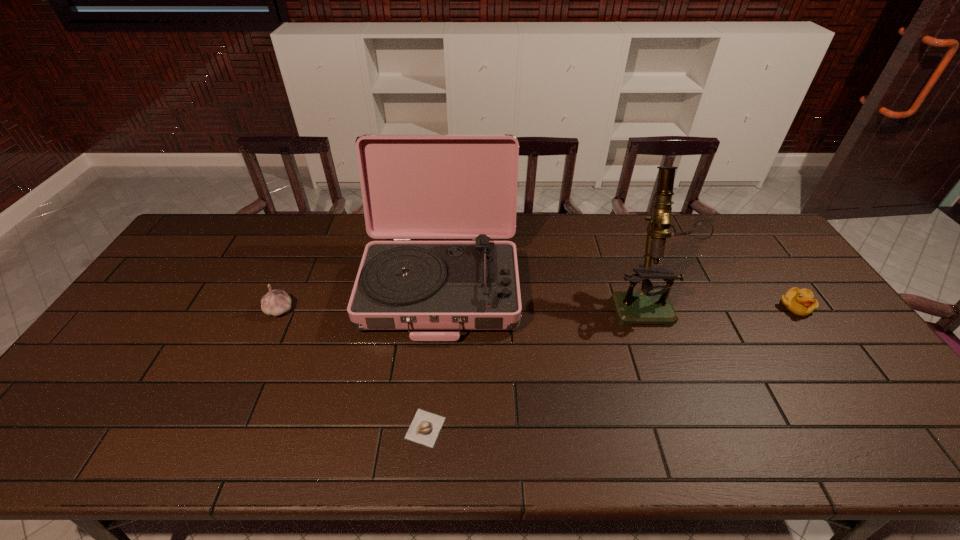
Find the location of a particular element. microscope is located at coordinates (652, 305).

This screenshot has width=960, height=540. Find the location of `record player`. record player is located at coordinates [413, 186].

Find the location of a particular element. the taller garlic is located at coordinates (276, 302).

Identify the location of the leftmost object. (276, 302).

Image resolution: width=960 pixels, height=540 pixels. In order to click on the rightmost object in this screenshot , I will do `click(801, 302)`.

Identify the location of the second shortest object. (801, 302).

At what (x,y) coordinates should I click in order to perform the action: click on the shorter garlic. Please return your answer as a coordinate pair (x, y). This screenshot has width=960, height=540. Looking at the image, I should click on (425, 427).

Identify the location of the nearer garlic. This screenshot has height=540, width=960. (425, 427).

Locate an element on the screen. This screenshot has width=960, height=540. free location located 0.230m at the eyepiece of the second object from right to left is located at coordinates (682, 398).

The image size is (960, 540). What are the coordinates of `vacant region located 0.100m with the lid open on the record player` in the screenshot? It's located at (432, 376).